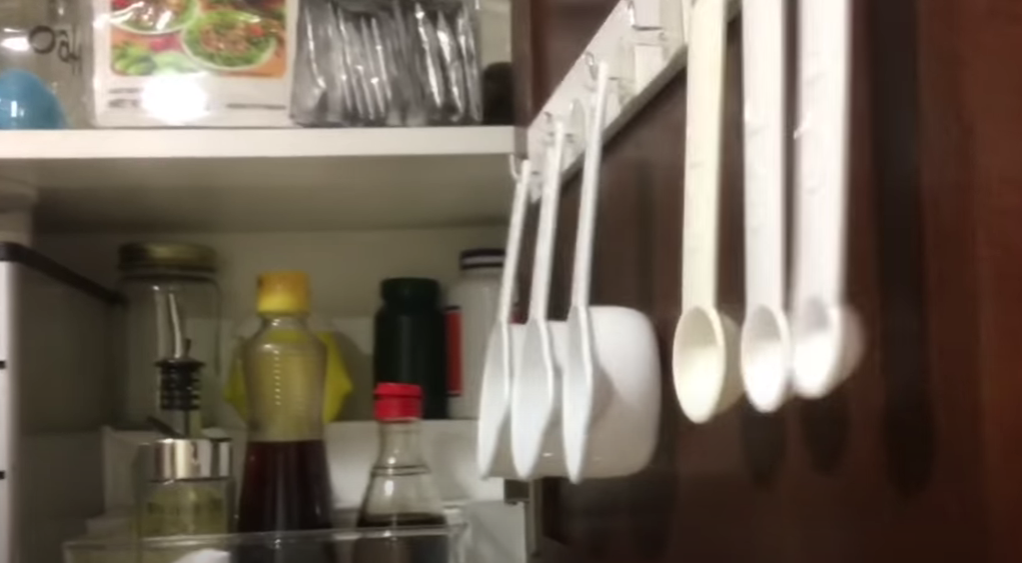
I want to click on clear jar, so [x=143, y=303].